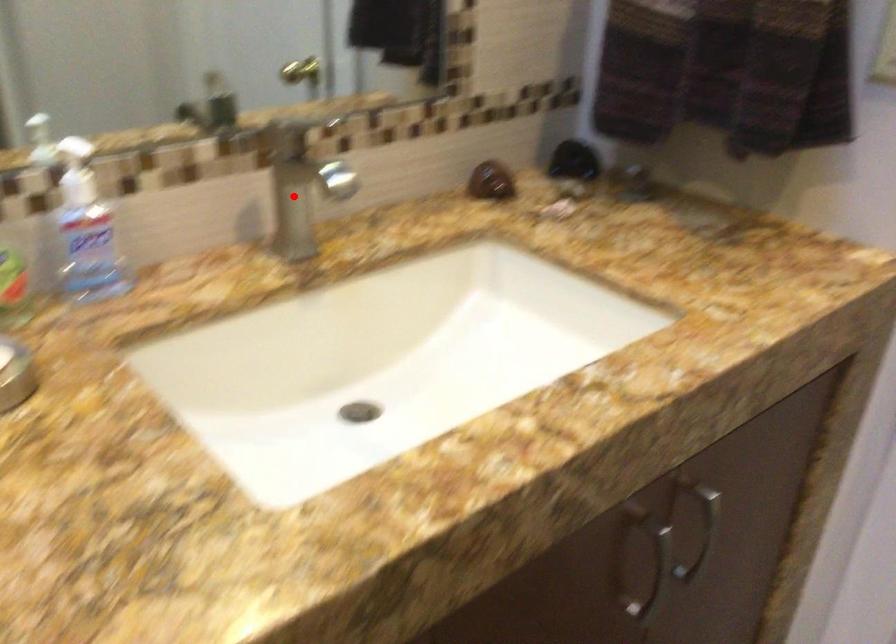
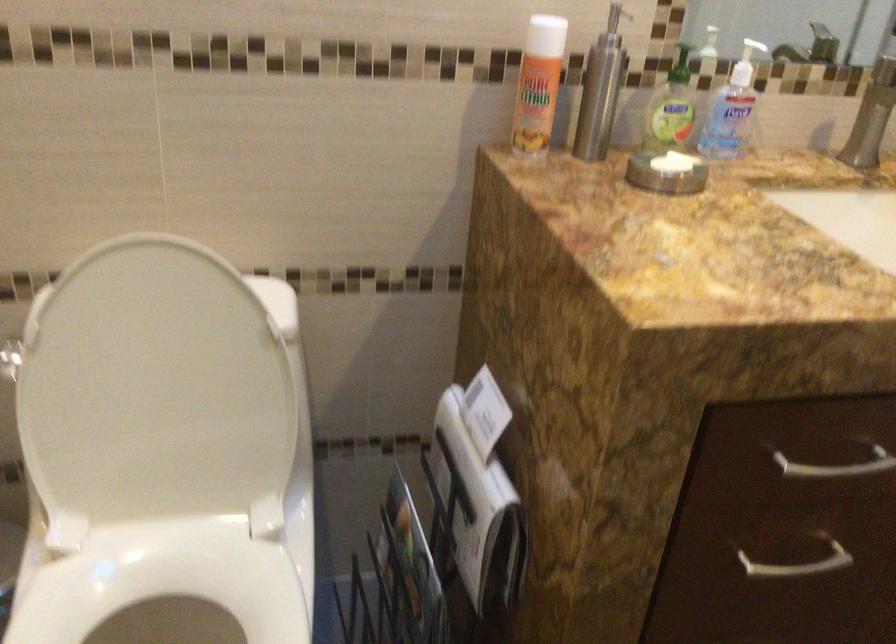
The point at the highlighted location is marked in the first image. Where is the corresponding point in the second image?

(872, 116)